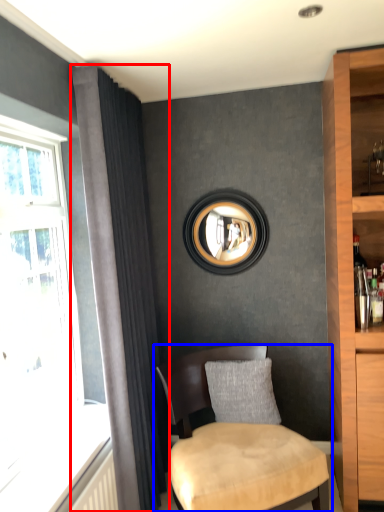
Question: Which object appears closest to the camera in this image, curtain (highlighted by a red box) or chair (highlighted by a blue box)?

Choices:
 (A) curtain
 (B) chair

Answer: (B)